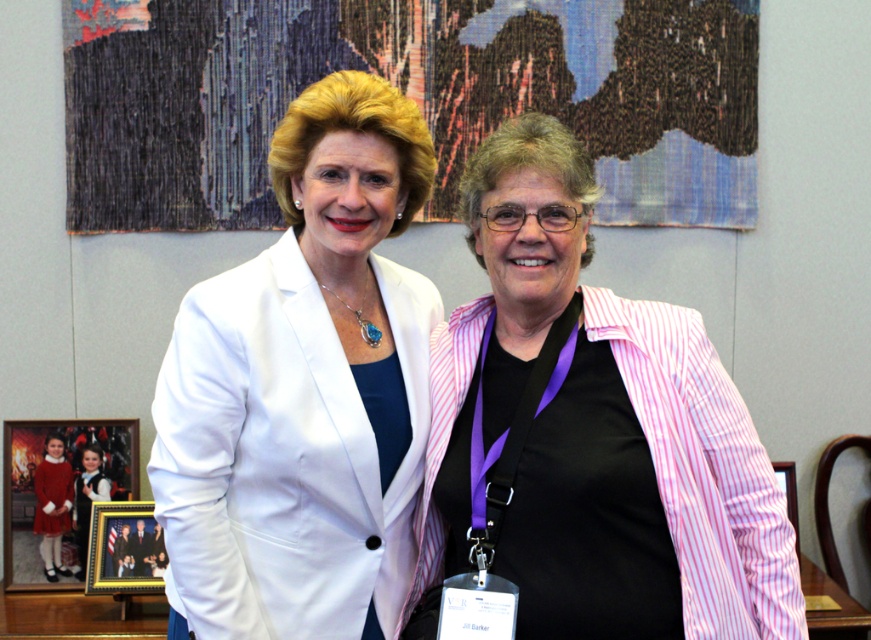
You are a photographer setting up for a group photo. You notice the white matte blazer at center and the wooden framed photo at lower left. Which object is positioned more to the right side of the image?

The white matte blazer at center is positioned more to the right side of the image compared to the wooden framed photo at lower left.

You are an interior designer assessing the layout of this room. You need to determine if the pink striped blazer at center and the wooden picture frame at right are arranged in a way that the blazer is positioned higher than the frame. Based on the scene description, can you confirm this spatial relationship?

The pink striped blazer at center is located above the wooden picture frame at right, so yes, the blazer is positioned higher than the frame.